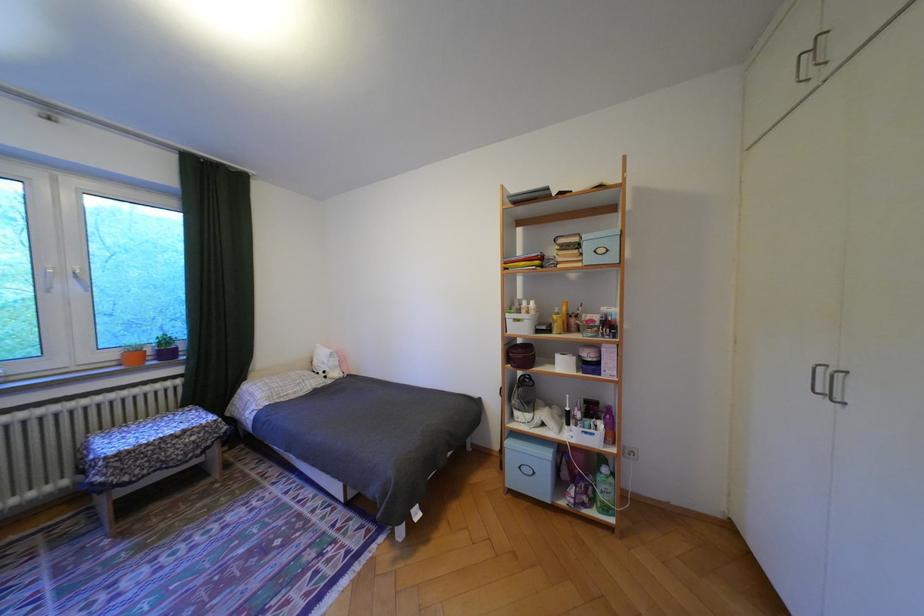
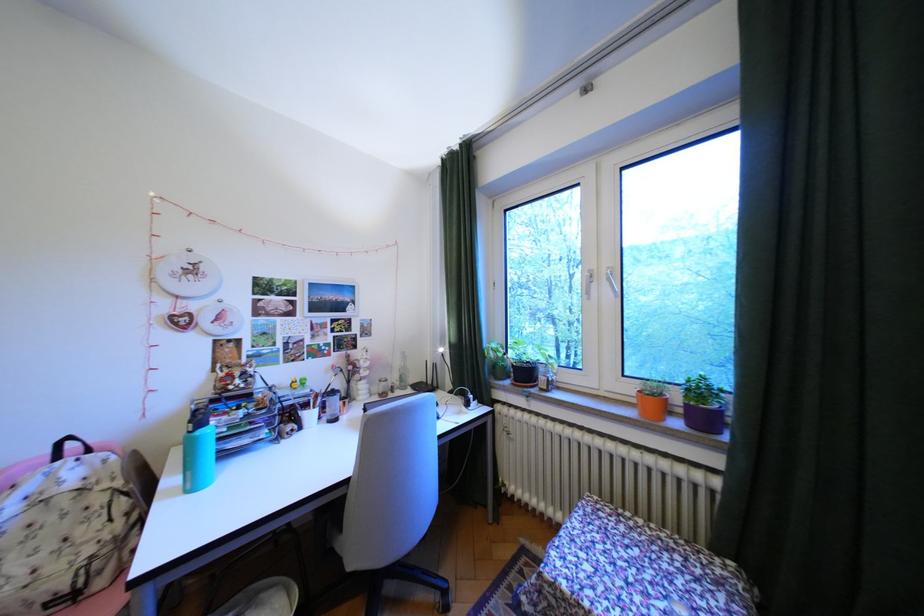
Locate, in the second image, the point that corresponds to (x=124, y=355) in the first image.

(641, 390)